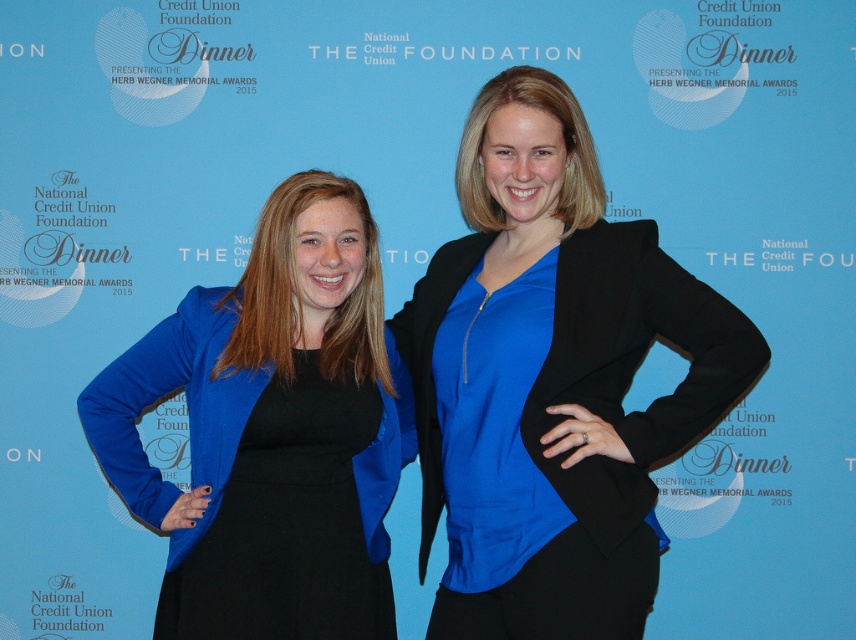
Question: Which object appears closest to the camera in this image?

Choices:
 (A) black matte blazer at center
 (B) matte blue blazer at center
 (C) black satin dress at center

Answer: (A)

Question: Considering the relative positions of matte blue blazer at center and black satin dress at center in the image provided, where is matte blue blazer at center located with respect to black satin dress at center?

Choices:
 (A) above
 (B) below

Answer: (A)

Question: Can you confirm if matte blue blazer at center is positioned above black satin dress at center?

Choices:
 (A) yes
 (B) no

Answer: (A)

Question: Which of these objects is positioned closest to the black satin dress at center?

Choices:
 (A) matte blue blazer at center
 (B) black matte blazer at center

Answer: (A)

Question: Which is farther from the black matte blazer at center?

Choices:
 (A) black satin dress at center
 (B) matte blue blazer at center

Answer: (B)

Question: Does black matte blazer at center have a smaller size compared to black satin dress at center?

Choices:
 (A) no
 (B) yes

Answer: (B)